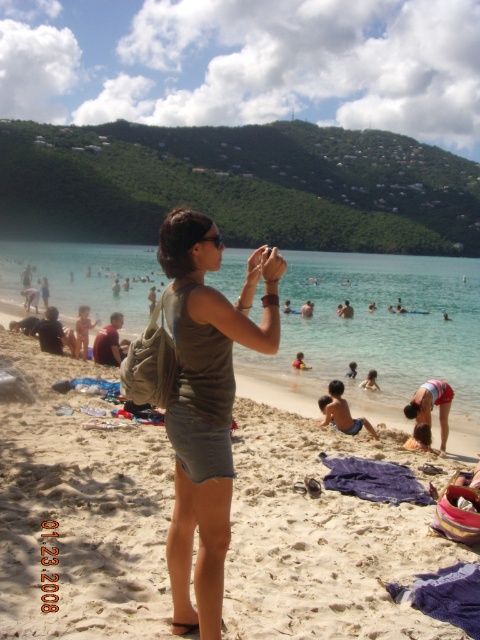
From the picture: You are a photographer taking a picture of the beach scene. You notice the red fabric bikini at lower right and the yellow life vest at center. Which object is closer to the bottom edge of the photo?

The red fabric bikini at lower right is positioned under the yellow life vest at center, so it is closer to the bottom edge of the photo.

You are a photographer trying to capture the texture of the beige sand at center and the matte gray tank top at center. Which object would you use a wider aperture setting for to ensure sharp focus on the subject?

The beige sand at center is smaller than the matte gray tank top at center, so you would use a wider aperture for the beige sand at center to ensure its texture is in sharp focus.

You are standing on the beach and want to take a photo of the point at coordinates (86, 333). Your camera has a minimum focus distance of 16 meters. Will you be able to focus on that point?

The point at coordinates (86, 333) is 15.98 meters away from the viewer. Since the minimum focus distance of the camera is 16 meters, the camera cannot focus on the point because it is slightly closer than the required distance.